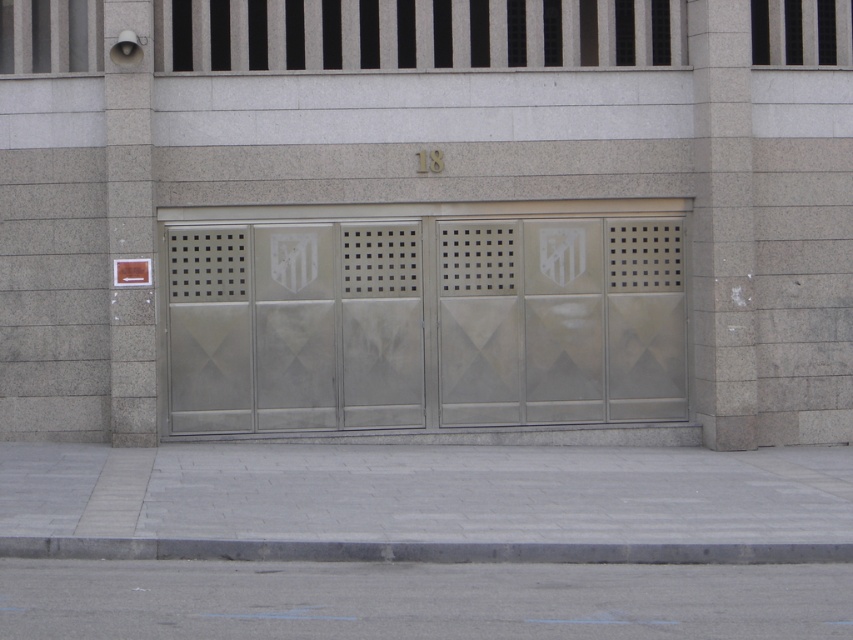
Between satin silver metal at center and gray concrete pavement at lower center, which one appears on the left side from the viewer's perspective?

From the viewer's perspective, satin silver metal at center appears more on the left side.

Does satin silver metal at center have a lesser width compared to gray concrete pavement at lower center?

Correct, satin silver metal at center's width is less than gray concrete pavement at lower center's.

Where is `satin silver metal at center`? The width and height of the screenshot is (853, 640). satin silver metal at center is located at coordinates (424, 323).

In the scene shown: Is satin silver metal at center taller than gray concrete curb at lower center?

Yes.

Who is taller, satin silver metal at center or gray concrete curb at lower center?

satin silver metal at center

You are a GUI agent. You are given a task and a screenshot of the screen. Output one action in this format:
    pyautogui.click(x=<x>, y=<y>)
    Task: Click on the satin silver metal at center
    The height and width of the screenshot is (640, 853).
    Given the screenshot: What is the action you would take?
    pyautogui.click(x=424, y=323)

Identify the location of satin silver metal at center. The image size is (853, 640). (424, 323).

Does gray concrete pavement at lower center have a greater width compared to gray concrete curb at lower center?

Correct, the width of gray concrete pavement at lower center exceeds that of gray concrete curb at lower center.

Is gray concrete pavement at lower center thinner than gray concrete curb at lower center?

Incorrect, gray concrete pavement at lower center's width is not less than gray concrete curb at lower center's.

The width and height of the screenshot is (853, 640). Find the location of `gray concrete pavement at lower center`. gray concrete pavement at lower center is located at coordinates (419, 600).